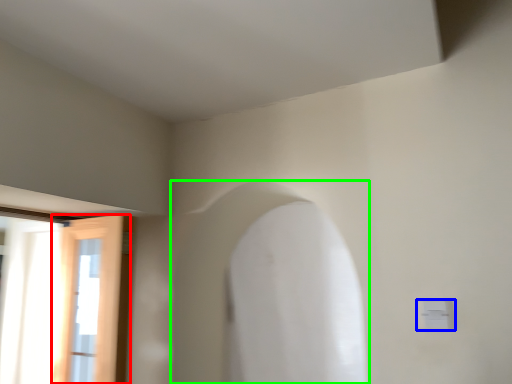
Question: Which object is positioned closest to door (highlighted by a red box)? Select from electric outlet (highlighted by a blue box) and archway (highlighted by a green box).

Choices:
 (A) electric outlet
 (B) archway

Answer: (B)